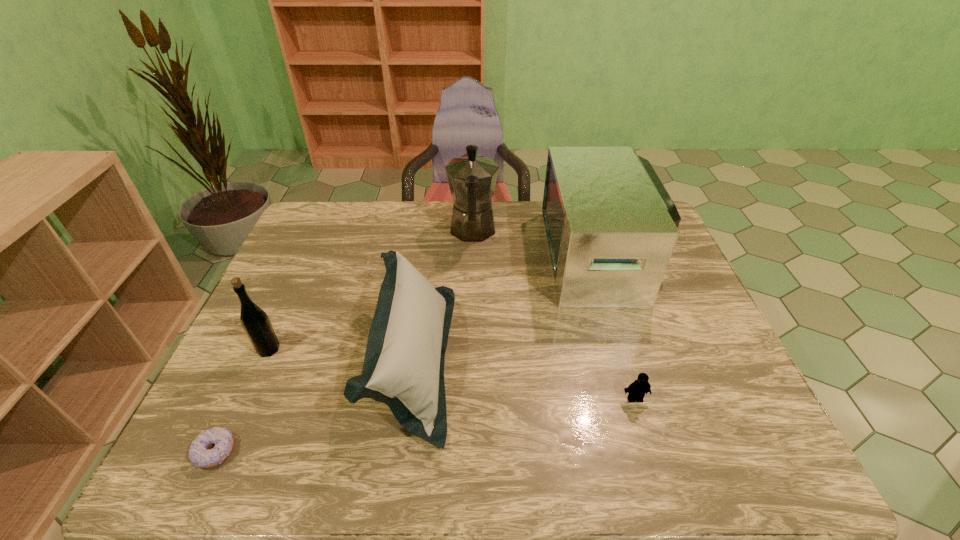
Identify the location of coffeepot. The image size is (960, 540). (472, 177).

The width and height of the screenshot is (960, 540). I want to click on microwave oven, so (x=611, y=227).

Locate an element on the screen. Image resolution: width=960 pixels, height=540 pixels. beer bottle is located at coordinates (255, 322).

Find the location of a particular element. The height and width of the screenshot is (540, 960). cushion is located at coordinates (403, 367).

The height and width of the screenshot is (540, 960). What are the coordinates of `Lego` in the screenshot? It's located at (636, 390).

Image resolution: width=960 pixels, height=540 pixels. Find the location of `doughnut`. doughnut is located at coordinates (198, 454).

You are a GUI agent. You are given a task and a screenshot of the screen. Output one action in this format:
    pyautogui.click(x=<x>, y=<y>)
    Task: Click on the vacant space located 0.050m on the pouring side of the coffeepot
    The height and width of the screenshot is (540, 960).
    Given the screenshot: What is the action you would take?
    (x=473, y=202)

Image resolution: width=960 pixels, height=540 pixels. What are the coordinates of `vacant space located on the pouring side of the coffeepot` in the screenshot? It's located at (473, 202).

At what (x,y) coordinates should I click in order to perform the action: click on vacant space located 0.050m on the front-facing side of the microwave oven. Please return your answer as a coordinate pair (x, y). Image resolution: width=960 pixels, height=540 pixels. Looking at the image, I should click on (533, 255).

This screenshot has height=540, width=960. Identify the location of free point located on the front-facing side of the microwave oven. (488, 255).